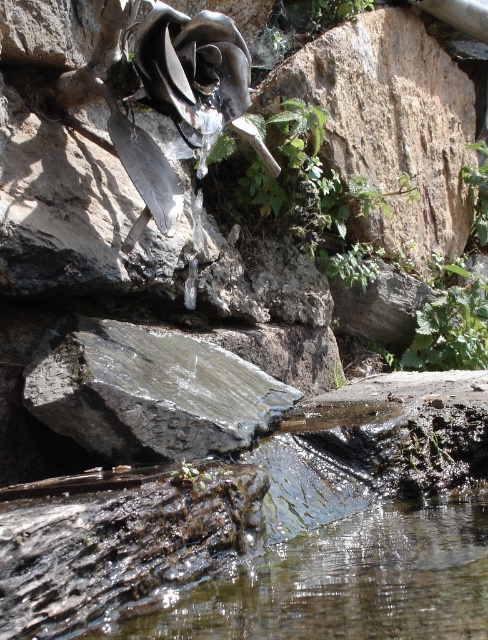
You are a GUI agent. You are given a task and a screenshot of the screen. Output one action in this format:
    pyautogui.click(x=<x>, y=<y>)
    Task: Click on the clear water at lower center
    
    Given the screenshot: What is the action you would take?
    pyautogui.click(x=343, y=582)

Looking at this image, does clear water at lower center appear on the left side of rough stone wall at upper right?

Indeed, clear water at lower center is positioned on the left side of rough stone wall at upper right.

Who is more distant from viewer, [367,568] or [407,164]?

The point [407,164] is behind.

Identify the location of clear water at lower center. [x=343, y=582].

Which is more to the right, clear water at lower center or gray rough rock at center?

clear water at lower center is more to the right.

From the picture: Does clear water at lower center have a lesser width compared to gray rough rock at center?

Incorrect, clear water at lower center's width is not less than gray rough rock at center's.

Does point (421, 608) come in front of point (142, 380)?

Yes, it is.

At what (x,y) coordinates should I click in order to perform the action: click on clear water at lower center. Please return your answer as a coordinate pair (x, y). Looking at the image, I should click on (343, 582).

Is rough stone wall at upper right above gray rough rock at center?

Correct, rough stone wall at upper right is located above gray rough rock at center.

Is rough stone wall at upper right closer to the viewer compared to gray rough rock at center?

No, it is behind gray rough rock at center.

Identify the location of rough stone wall at upper right. This screenshot has width=488, height=640. (390, 125).